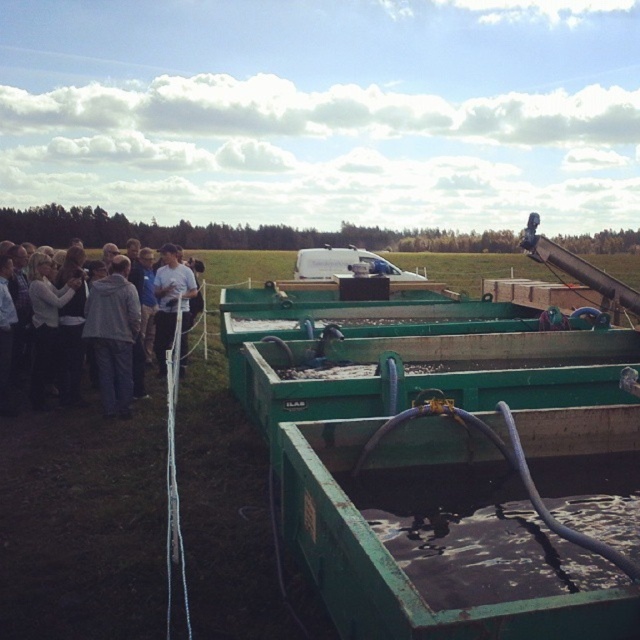
Can you confirm if light gray hoodie at left is bigger than white matte shirt at center?

Yes.

Is light gray hoodie at left to the left of white matte shirt at center from the viewer's perspective?

Yes, light gray hoodie at left is to the left of white matte shirt at center.

The width and height of the screenshot is (640, 640). Find the location of `light gray hoodie at left`. light gray hoodie at left is located at coordinates click(51, 324).

Which is more to the right, light gray hoodie at left or gray fabric jacket at left?

Positioned to the right is gray fabric jacket at left.

Does light gray hoodie at left appear over gray fabric jacket at left?

Correct, light gray hoodie at left is located above gray fabric jacket at left.

Who is more distant from viewer, (51, 260) or (132, 291)?

The point (51, 260) is behind.

This screenshot has height=640, width=640. I want to click on light gray hoodie at left, so click(51, 324).

Does gray fabric jacket at left appear under white matte shirt at center?

Yes.

This screenshot has width=640, height=640. I want to click on gray fabric jacket at left, so point(113,333).

Find the location of a particular element. gray fabric jacket at left is located at coordinates (113, 333).